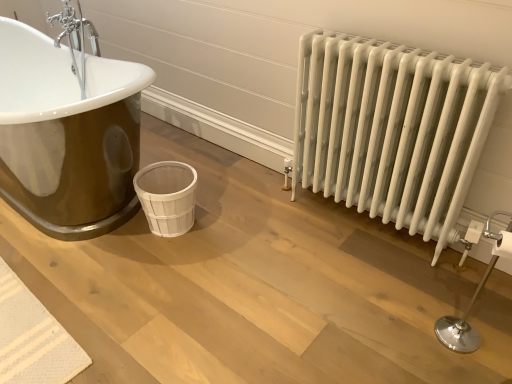
You are a GUI agent. You are given a task and a screenshot of the screen. Output one action in this format:
    pyautogui.click(x=<x>, y=<y>)
    Task: Click on the free space to the left of white painted metal radiator at right
    Image resolution: width=512 pixels, height=384 pixels.
    Given the screenshot: What is the action you would take?
    pyautogui.click(x=264, y=230)